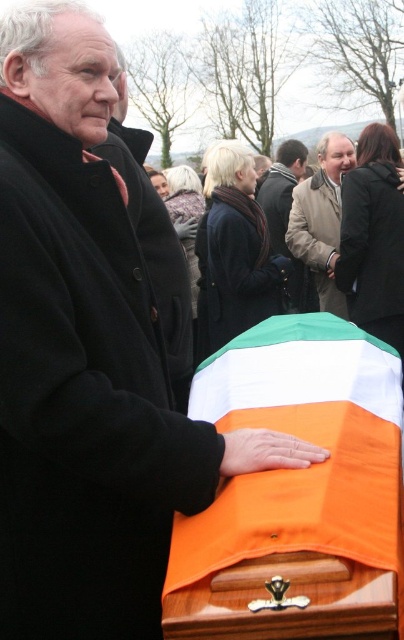
The height and width of the screenshot is (640, 404). I want to click on orange fabric flag at lower center, so click(305, 440).

Is orange fabric flag at lower center smaller than beige wool coat at center?

Incorrect, orange fabric flag at lower center is not smaller in size than beige wool coat at center.

Between point (368, 465) and point (340, 147), which one is positioned in front?

Point (368, 465) is in front.

Find the location of a particular element. The width and height of the screenshot is (404, 640). orange fabric flag at lower center is located at coordinates [x=305, y=440].

Which is more to the left, orange fabric flag at lower center or dark brown leather jacket at center?

orange fabric flag at lower center is more to the left.

Is orange fabric flag at lower center to the right of dark brown leather jacket at center from the viewer's perspective?

No, orange fabric flag at lower center is not to the right of dark brown leather jacket at center.

The image size is (404, 640). Identify the location of orange fabric flag at lower center. (305, 440).

Does point (336, 304) lie in front of point (275, 202)?

Yes, point (336, 304) is in front of point (275, 202).

Does beige wool coat at center have a greater height compared to dark brown leather jacket at center?

No.

Does point (340, 154) come farther from viewer compared to point (298, 168)?

No, it is not.

At what (x,y) coordinates should I click in order to perform the action: click on beige wool coat at center. Please return your answer as a coordinate pair (x, y). The image size is (404, 640). Looking at the image, I should click on (321, 220).